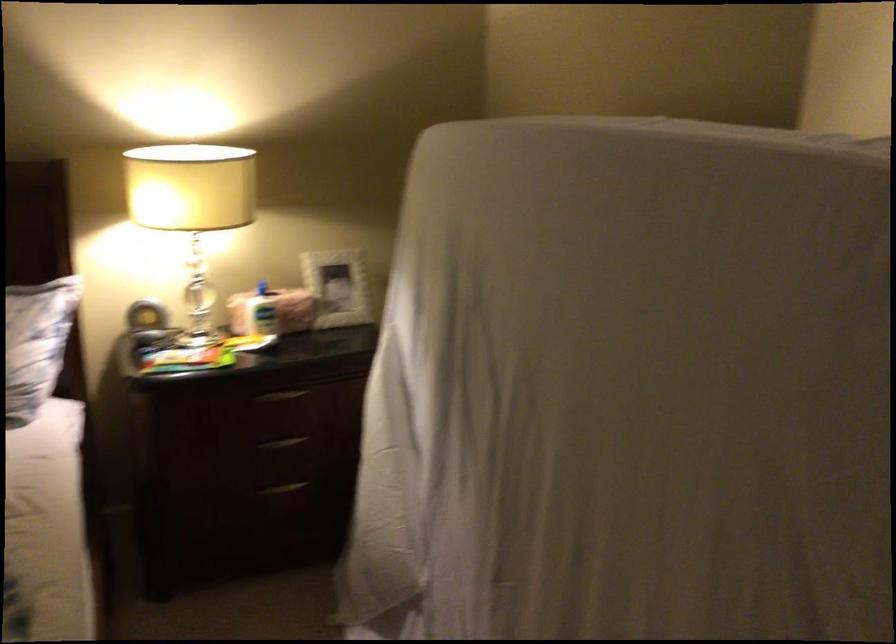
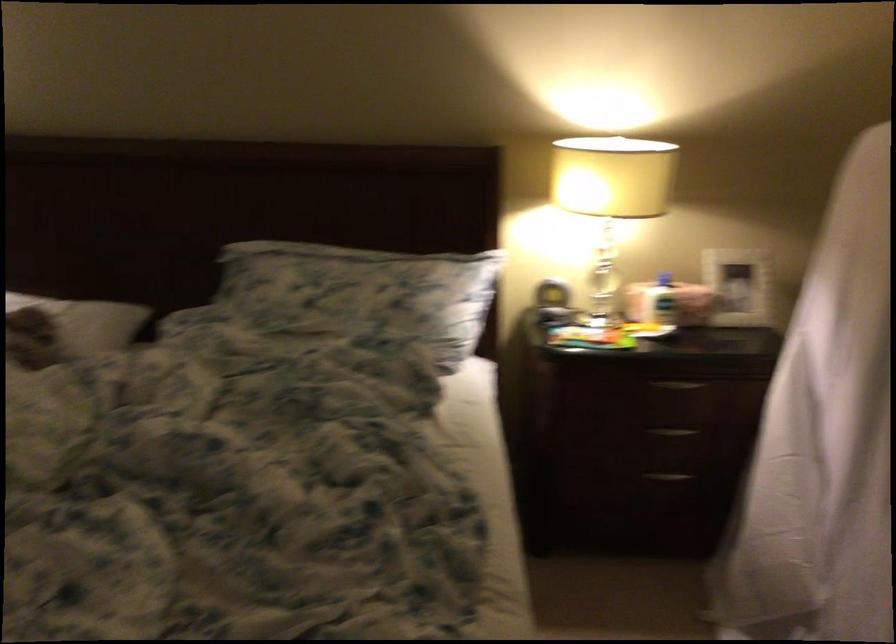
The point at [280,399] is marked in the first image. Where is the corresponding point in the second image?

(679, 384)